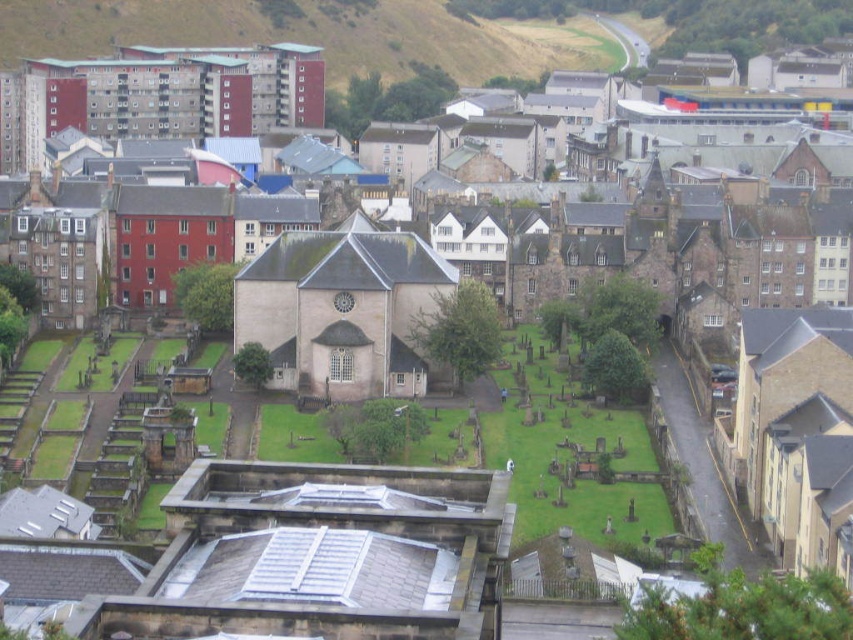
Which is in front, point (294, 289) or point (323, 64)?

Point (294, 289) is in front.

Between point (366, 342) and point (198, 52), which one is positioned in front?

Point (366, 342) is in front.

Where is `smooth stone church at center`? This screenshot has width=853, height=640. smooth stone church at center is located at coordinates pos(341,310).